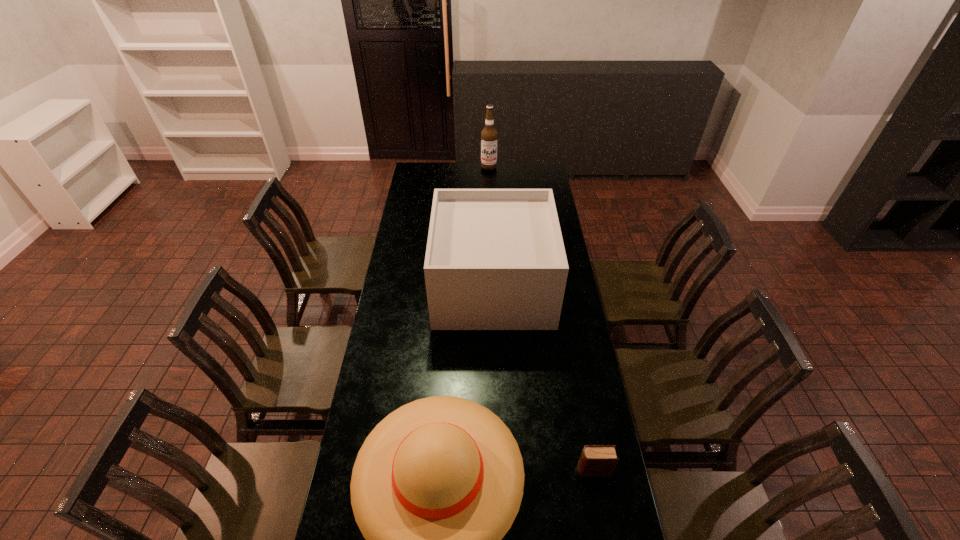
I want to click on object situated at the far edge, so click(489, 136).

You are a GUI agent. You are given a task and a screenshot of the screen. Output one action in this format:
    pyautogui.click(x=<x>, y=<y>)
    Task: Click on the box at the right edge
    
    Given the screenshot: What is the action you would take?
    pyautogui.click(x=495, y=259)

At what (x,y) coordinates should I click in order to perform the action: click on diary that is at the right edge. Please return your answer as a coordinate pair (x, y). The height and width of the screenshot is (540, 960). Looking at the image, I should click on (596, 460).

Locate an element on the screen. free spot at the far edge of the desktop is located at coordinates (493, 179).

This screenshot has width=960, height=540. In order to click on free space at the left edge of the desktop in this screenshot , I will do `click(415, 306)`.

This screenshot has width=960, height=540. What are the coordinates of `vacant region at the right edge of the desktop` in the screenshot? It's located at (566, 282).

I want to click on blank space at the far left corner of the desktop, so click(418, 167).

The image size is (960, 540). In order to click on free spot between the diary and the box in this screenshot , I will do `click(543, 377)`.

Image resolution: width=960 pixels, height=540 pixels. What are the coordinates of `empty space between the diary and the second farthest object` in the screenshot? It's located at (543, 377).

Select which object is the closest to the second farthest object. Please provide its 2D coordinates. Your answer should be formatted as a tuple, i.e. [(x, y)], where the tuple contains the x and y coordinates of a point satisfying the conditions above.

[(436, 485)]